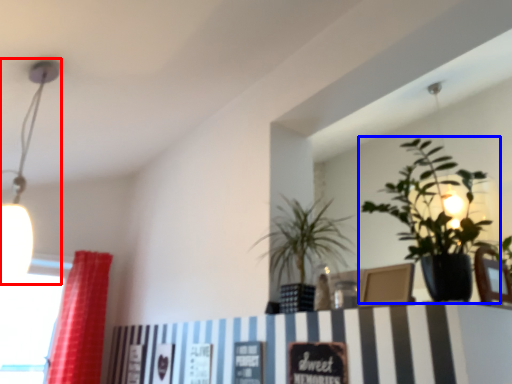
Question: Which point is closer to the camera, lamp (highlighted by a red box) or houseplant (highlighted by a blue box)?

Choices:
 (A) lamp
 (B) houseplant

Answer: (B)